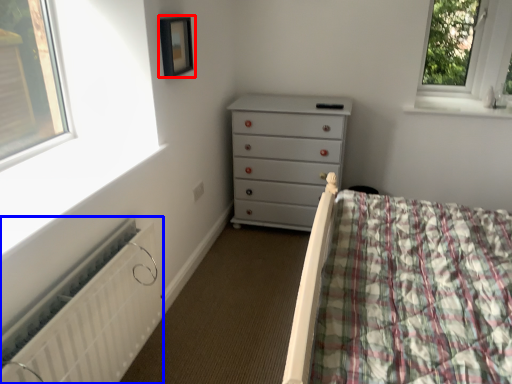
Question: Which object appears closest to the camera in this image, picture frame (highlighted by a red box) or radiator (highlighted by a blue box)?

Choices:
 (A) picture frame
 (B) radiator

Answer: (B)